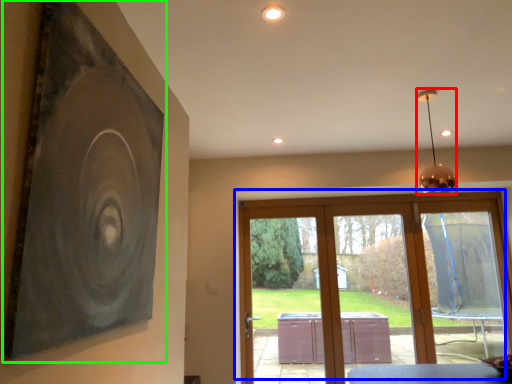
Question: Which object is positioned closest to lamp (highlighted by a red box)? Select from window (highlighted by a blue box) and picture frame (highlighted by a green box).

Choices:
 (A) window
 (B) picture frame

Answer: (B)